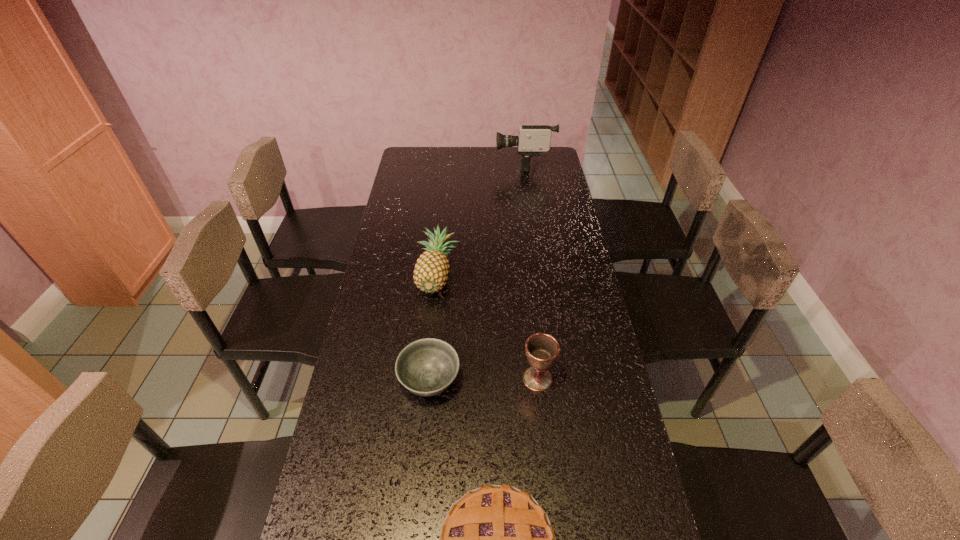
Identify the location of free space located 0.110m on the back of the bowl. The image size is (960, 540). (435, 327).

Locate an element on the screen. This screenshot has height=540, width=960. object at the far edge is located at coordinates (533, 139).

At what (x,y) coordinates should I click in order to perform the action: click on pineapple that is at the left edge. Please return your answer as a coordinate pair (x, y). The height and width of the screenshot is (540, 960). Looking at the image, I should click on (431, 271).

The width and height of the screenshot is (960, 540). I want to click on bowl that is positioned at the left edge, so click(x=426, y=367).

Where is `object present at the right edge`? Image resolution: width=960 pixels, height=540 pixels. object present at the right edge is located at coordinates (533, 139).

Identify the location of object present at the far right corner. (533, 139).

This screenshot has width=960, height=540. Identify the location of vacant area at the far edge of the desktop. (488, 172).

Where is `free space at the left edge`? Image resolution: width=960 pixels, height=540 pixels. free space at the left edge is located at coordinates pos(368,500).

Image resolution: width=960 pixels, height=540 pixels. In the image, there is a desktop. In order to click on free space at the right edge in this screenshot , I will do `click(566, 305)`.

Identify the location of vacant space at the far right corner. This screenshot has width=960, height=540. (549, 164).